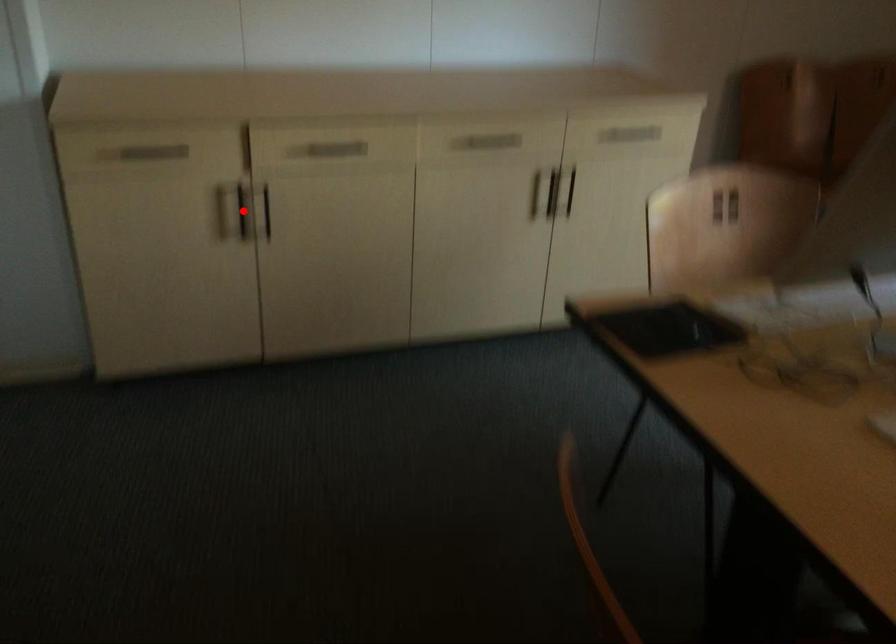
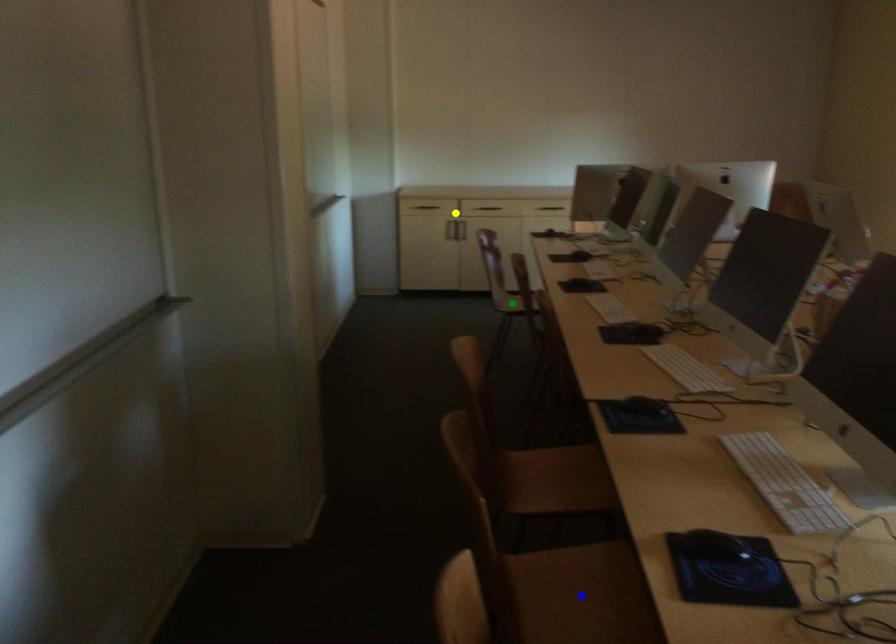
Question: I am providing you with two images of the same scene from different viewpoints. A red point is marked on the first image. You are given multiple points on the second image. Can you choose the point in image 2 that corresponds to the point in image 1?

Choices:
 (A) yellow point
 (B) green point
 (C) blue point

Answer: (A)